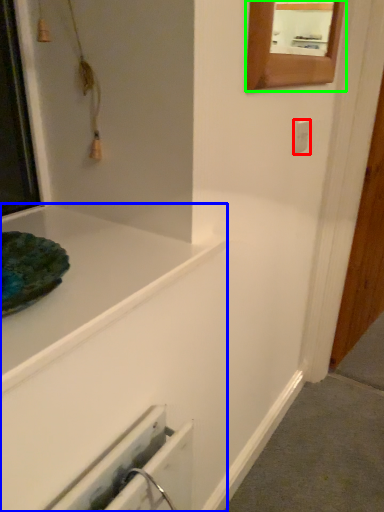
Question: Which object is positioned farthest from electric outlet (highlighted by a red box)? Select from bathtub (highlighted by a blue box) and mirror (highlighted by a green box).

Choices:
 (A) bathtub
 (B) mirror

Answer: (A)